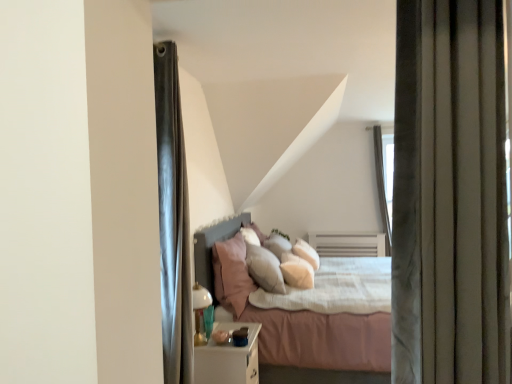
Question: Is soft white pillow at center, arranged as the 2th pillow when viewed from the left, oriented towards velvet gray curtain at right?

Choices:
 (A) yes
 (B) no

Answer: (B)

Question: Is soft white pillow at center, the first pillow positioned from the right, positioned with its back to velvet gray curtain at right?

Choices:
 (A) no
 (B) yes

Answer: (A)

Question: From the image's perspective, does soft white pillow at center, the first pillow positioned from the right, appear lower than velvet gray curtain at right?

Choices:
 (A) yes
 (B) no

Answer: (A)

Question: Does soft white pillow at center, arranged as the 2th pillow when viewed from the left, contain velvet gray curtain at right?

Choices:
 (A) no
 (B) yes

Answer: (A)

Question: Is the depth of soft white pillow at center, arranged as the 2th pillow when viewed from the left, less than that of velvet gray curtain at right?

Choices:
 (A) yes
 (B) no

Answer: (B)

Question: Can we say soft white pillow at center, the first pillow positioned from the right, lies outside velvet gray curtain at right?

Choices:
 (A) yes
 (B) no

Answer: (A)

Question: Considering the relative sizes of white glossy nightstand at lower center and pink fabric pillow at center, the first pillow positioned from the left, in the image provided, is white glossy nightstand at lower center taller than pink fabric pillow at center, the first pillow positioned from the left,?

Choices:
 (A) yes
 (B) no

Answer: (B)

Question: Can you confirm if white glossy nightstand at lower center is shorter than pink fabric pillow at center, the first pillow positioned from the left?

Choices:
 (A) yes
 (B) no

Answer: (A)

Question: Considering the relative sizes of white glossy nightstand at lower center and pink fabric pillow at center, the 2th pillow when ordered from right to left, in the image provided, is white glossy nightstand at lower center thinner than pink fabric pillow at center, the 2th pillow when ordered from right to left,?

Choices:
 (A) no
 (B) yes

Answer: (A)

Question: From a real-world perspective, is white glossy nightstand at lower center over pink fabric pillow at center, the first pillow positioned from the left?

Choices:
 (A) no
 (B) yes

Answer: (A)

Question: Considering the relative sizes of white glossy nightstand at lower center and pink fabric pillow at center, the first pillow positioned from the left, in the image provided, is white glossy nightstand at lower center bigger than pink fabric pillow at center, the first pillow positioned from the left,?

Choices:
 (A) yes
 (B) no

Answer: (B)

Question: Does white glossy nightstand at lower center come behind pink fabric pillow at center, the 2th pillow when ordered from right to left?

Choices:
 (A) yes
 (B) no

Answer: (B)

Question: From a real-world perspective, is pink fabric pillow at center, the first pillow positioned from the left, on top of soft white pillow at center, the first pillow positioned from the right?

Choices:
 (A) no
 (B) yes

Answer: (B)